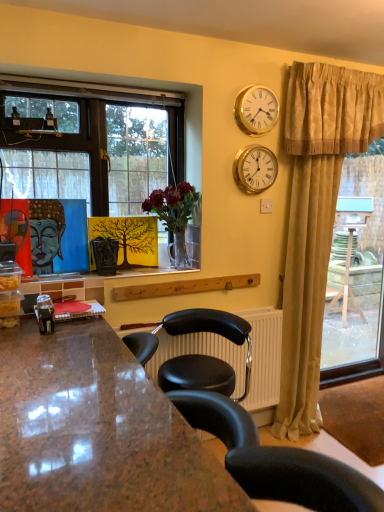
Where is `free region under clear glass vase at center (from a real-world perspective)`? This screenshot has height=512, width=384. free region under clear glass vase at center (from a real-world perspective) is located at coordinates (169, 268).